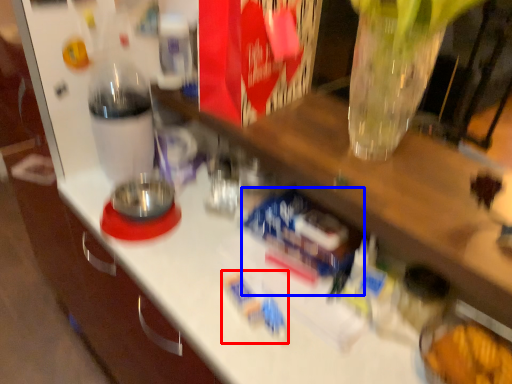
Question: Among these objects, which one is nearest to the camera, toy (highlighted by a red box) or toy (highlighted by a blue box)?

Choices:
 (A) toy
 (B) toy

Answer: (A)